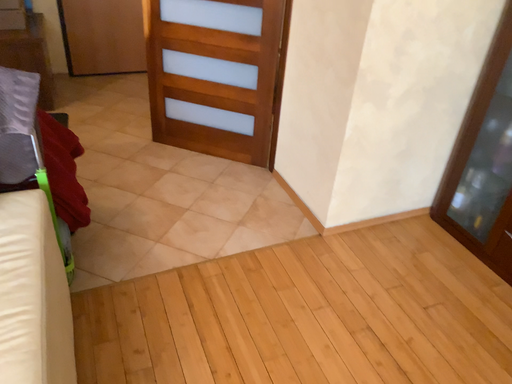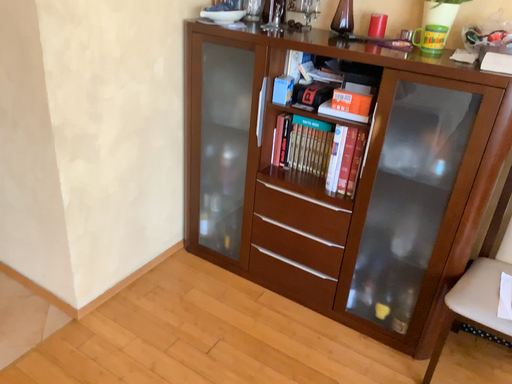
Question: How did the camera likely rotate when shooting the video?

Choices:
 (A) rotated upward
 (B) rotated downward

Answer: (A)